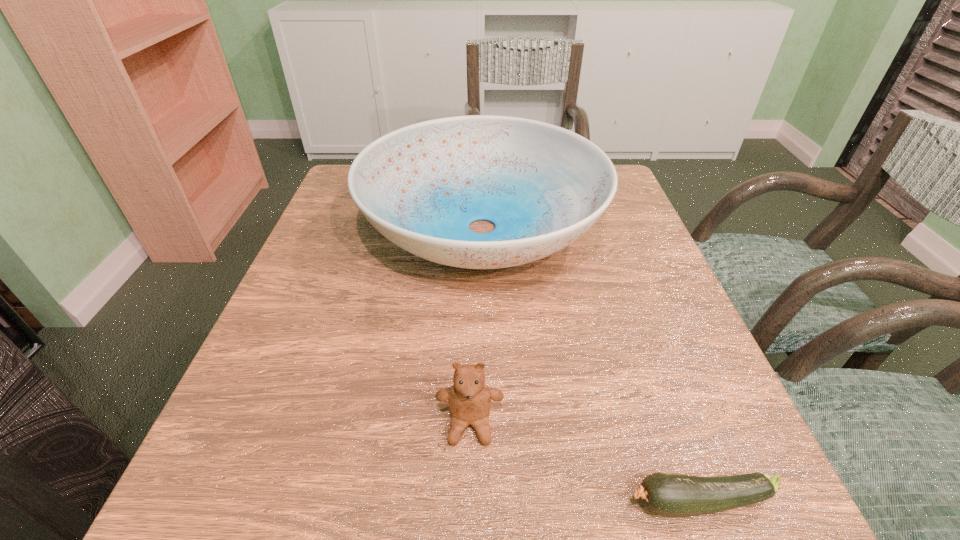
What are the coordinates of `vacant space in between the farthest object and the second farthest object` in the screenshot? It's located at (476, 326).

The height and width of the screenshot is (540, 960). I want to click on vacant point located between the second tallest object and the shortest object, so click(585, 463).

Locate an element on the screen. The height and width of the screenshot is (540, 960). vacant area that lies between the zucchini and the second farthest object is located at coordinates (585, 463).

Locate an element on the screen. the closest object to the tallest object is located at coordinates (469, 399).

Locate an element on the screen. This screenshot has width=960, height=540. object that stands as the closest to the second nearest object is located at coordinates (673, 495).